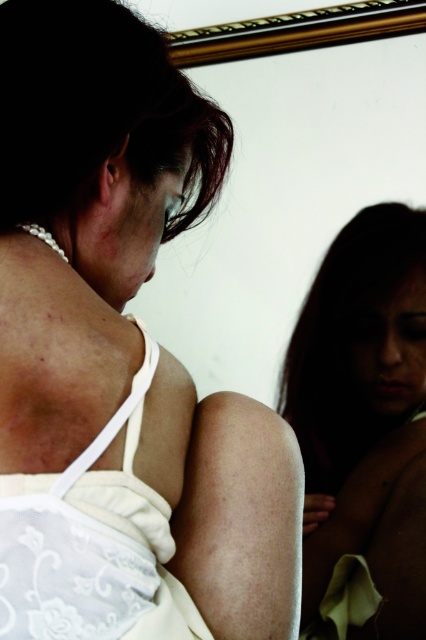
Question: Does dark brown hair at upper left lie in front of dark brown hair at lower right?

Choices:
 (A) no
 (B) yes

Answer: (B)

Question: Does white lace dress at center appear on the right side of dark brown hair at upper left?

Choices:
 (A) no
 (B) yes

Answer: (B)

Question: Which point is farther to the camera?

Choices:
 (A) white lace wedding dress at upper left
 (B) dark brown hair at lower right

Answer: (B)

Question: Is white lace dress at center bigger than dark brown hair at lower right?

Choices:
 (A) yes
 (B) no

Answer: (A)

Question: Which point is closer to the camera?

Choices:
 (A) white lace dress at center
 (B) dark brown hair at lower right
 (C) white lace wedding dress at upper left
 (D) dark brown hair at upper left

Answer: (A)

Question: Estimate the real-world distances between objects in this image. Which object is closer to the white lace wedding dress at upper left?

Choices:
 (A) dark brown hair at lower right
 (B) white lace dress at center
 (C) dark brown hair at upper left

Answer: (B)